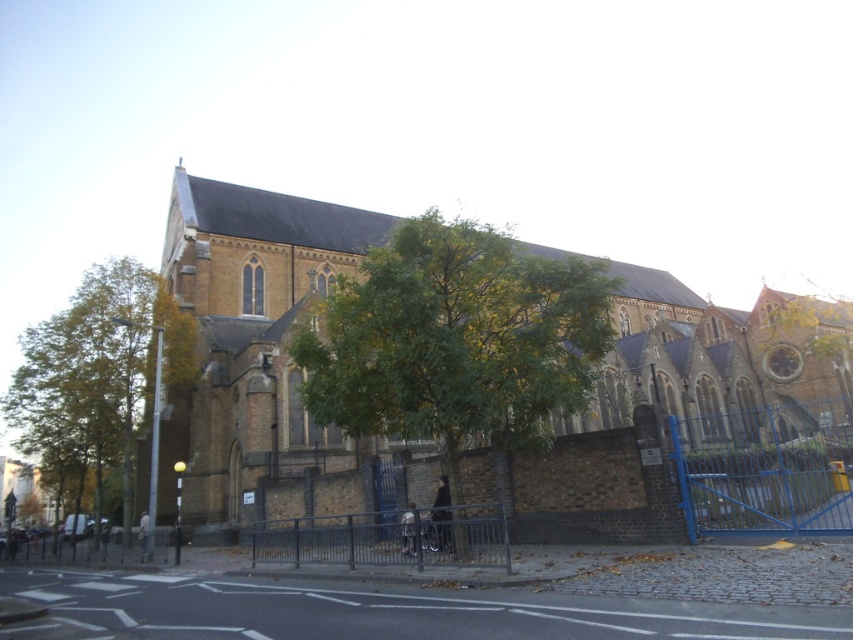
Based on the photo, who is taller, green leafy tree at center or metallic gray fence at lower left?

green leafy tree at center

Who is positioned more to the left, green leafy tree at center or metallic gray fence at lower left?

Positioned to the left is metallic gray fence at lower left.

Does point (486, 376) come in front of point (131, 541)?

Yes.

Identify the location of green leafy tree at center. (456, 339).

Who is more forward, (827, 406) or (80, 552)?

Point (80, 552)

Can you confirm if blue metallic gate at right is wider than metallic gray fence at lower left?

Yes, blue metallic gate at right is wider than metallic gray fence at lower left.

Find the location of a particular element. The height and width of the screenshot is (640, 853). blue metallic gate at right is located at coordinates (766, 468).

Find the location of `brown brick church at center`. brown brick church at center is located at coordinates (254, 324).

Between brown brick church at center and silver metallic fence at center, which one appears on the left side from the viewer's perspective?

silver metallic fence at center is more to the left.

This screenshot has height=640, width=853. In order to click on brown brick church at center in this screenshot , I will do `click(254, 324)`.

What are the coordinates of `brown brick church at center` in the screenshot? It's located at (254, 324).